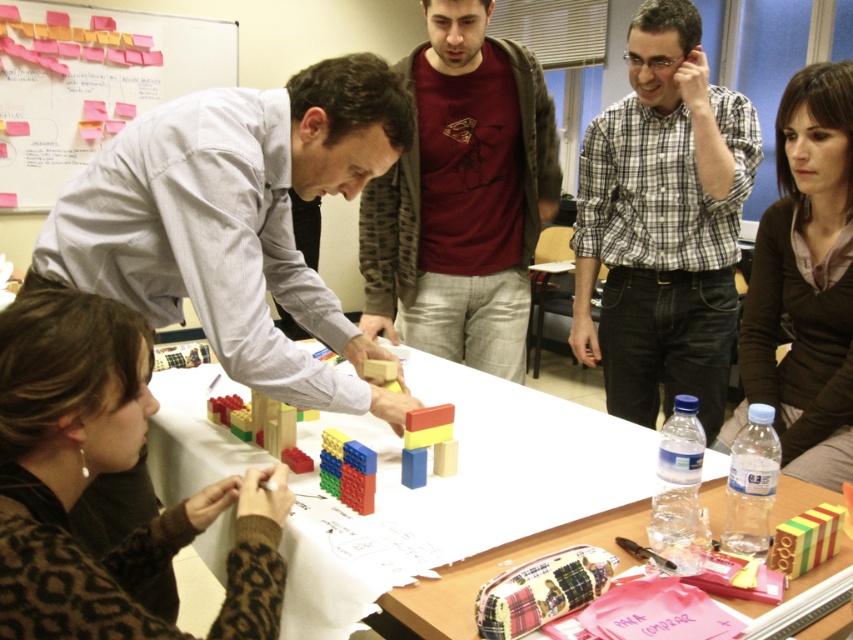
You are observing a group of people working on a building block project. You notice a matte gray shirt at center and rubberized plastic building blocks at center. Which object takes up more space in the scene?

The matte gray shirt at center is larger in size than the rubberized plastic building blocks at center, so the matte gray shirt at center takes up more space in the scene.

You are a photographer standing at the back of the room. You want to take a photo of the matte gray shirt at center and the brown zippered jacket at upper right. Which of the two will appear bigger in the photo?

The matte gray shirt at center will appear bigger in the photo because it is larger in size than the brown zippered jacket at upper right.

You are observing a group of people working on a project with blocks. There is a leopard print sweater at lower left and wooden toy blocks at center. Which object is closer to you?

The leopard print sweater at lower left is closer to you because it is in front of the wooden toy blocks at center.